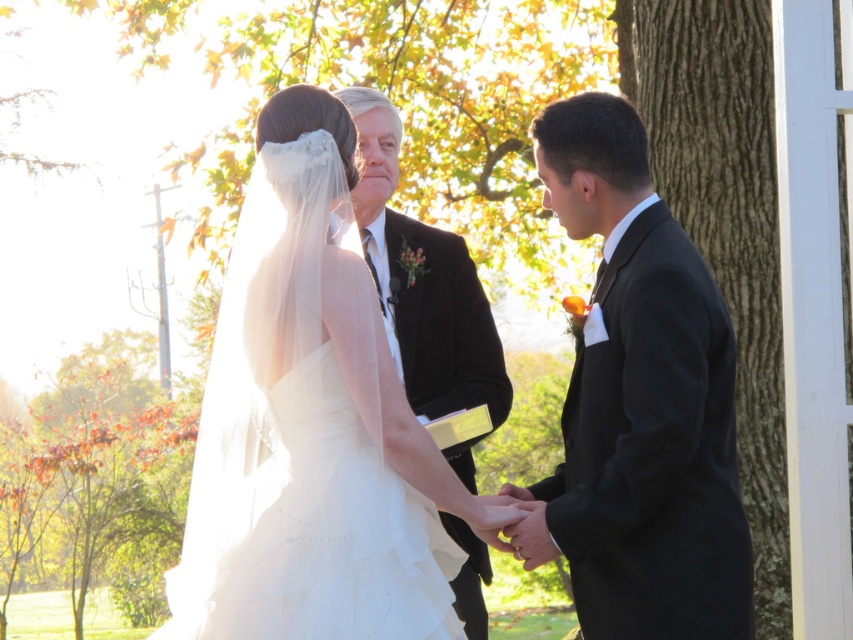
Based on the scene description, can you determine which object is taller between the white tulle wedding dress at center and the smooth bark tree at right?

The white tulle wedding dress at center is not as tall as the smooth bark tree at right, so the smooth bark tree at right is taller.

What are the coordinates of the white tulle wedding dress at center in the image?

The white tulle wedding dress at center is located at coordinates point (312, 532).